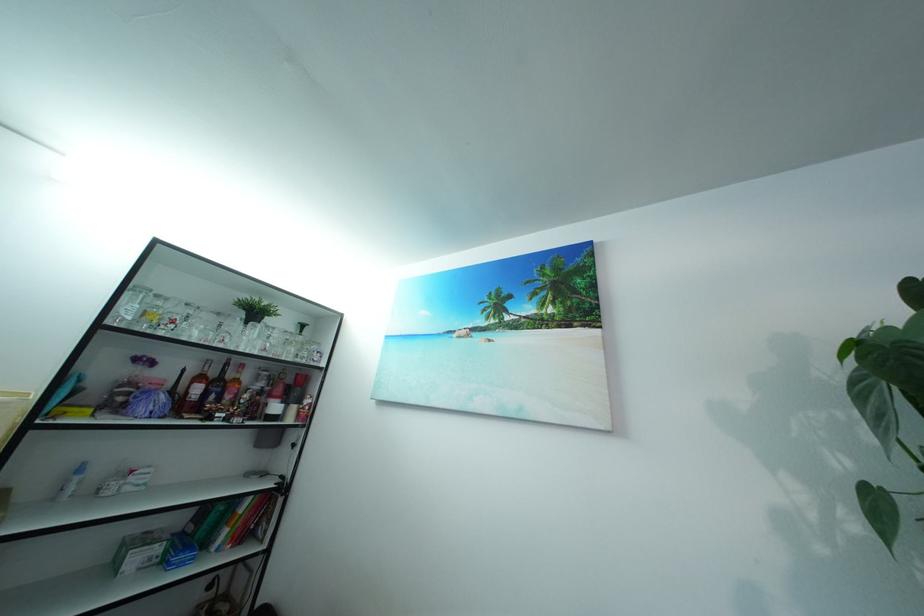
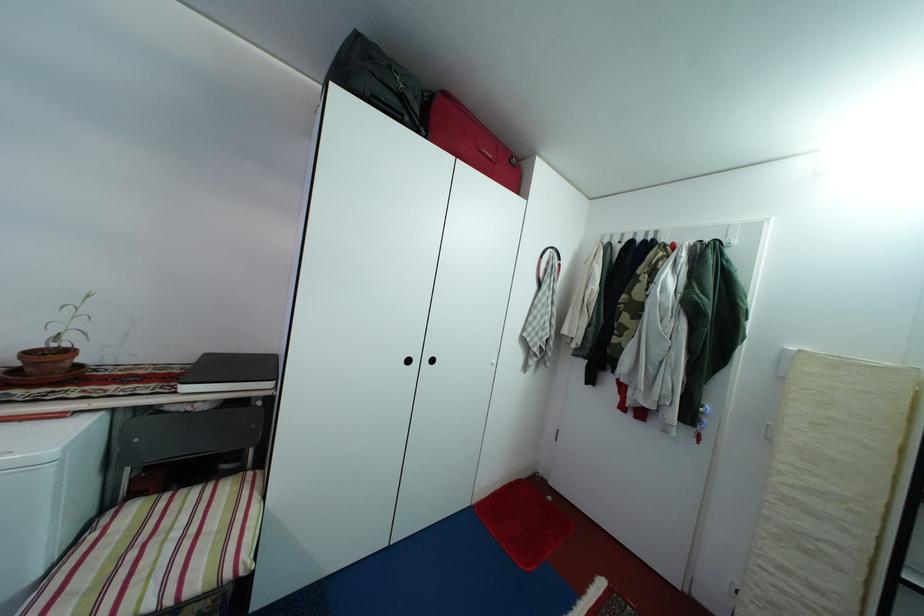
Question: The camera is either moving clockwise (left) or counter-clockwise (right) around the object. The first image is from the beginning of the video and the second image is from the end. Is the camera moving left or right when shooting the video?

Choices:
 (A) Left
 (B) Right

Answer: (B)